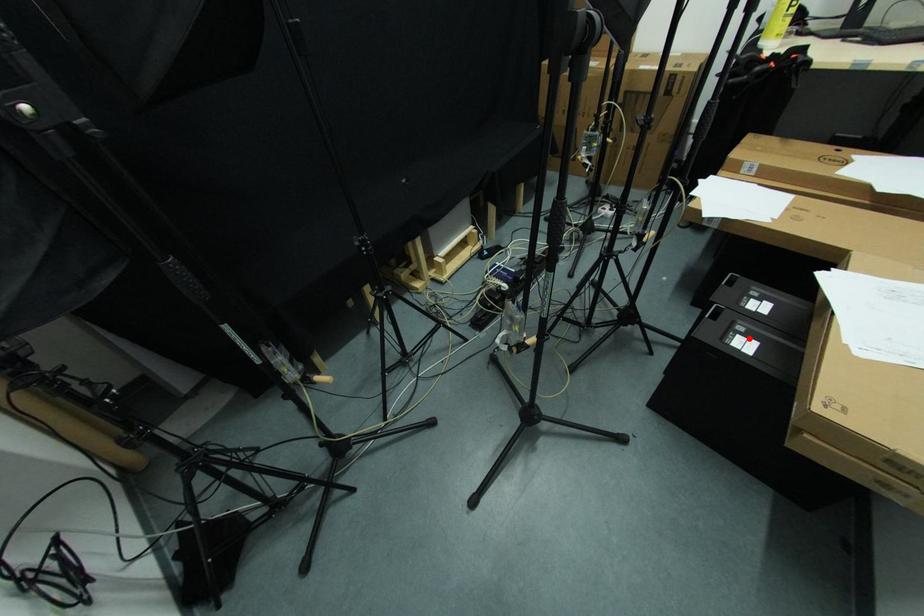
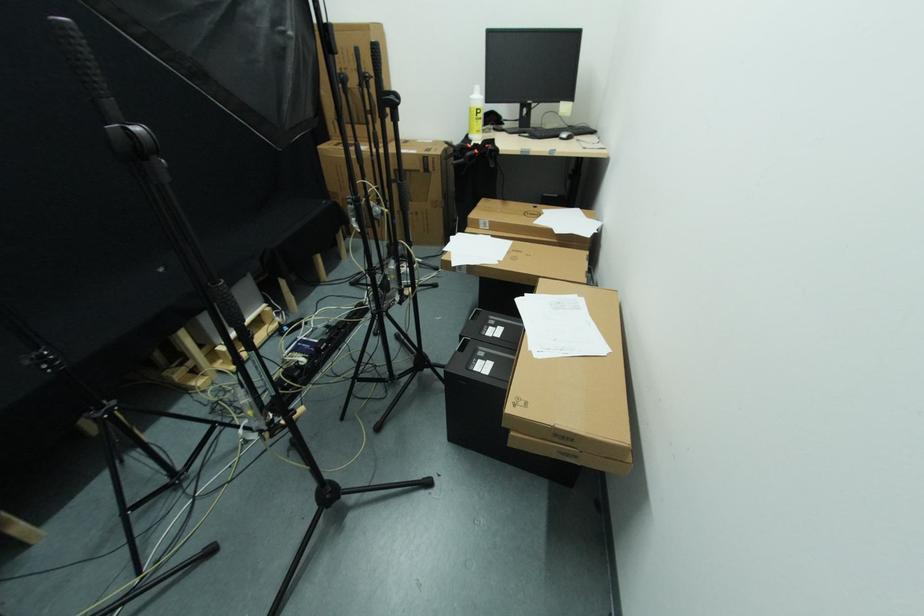
The point at the highlighted location is marked in the first image. Where is the corresponding point in the second image?

(487, 361)